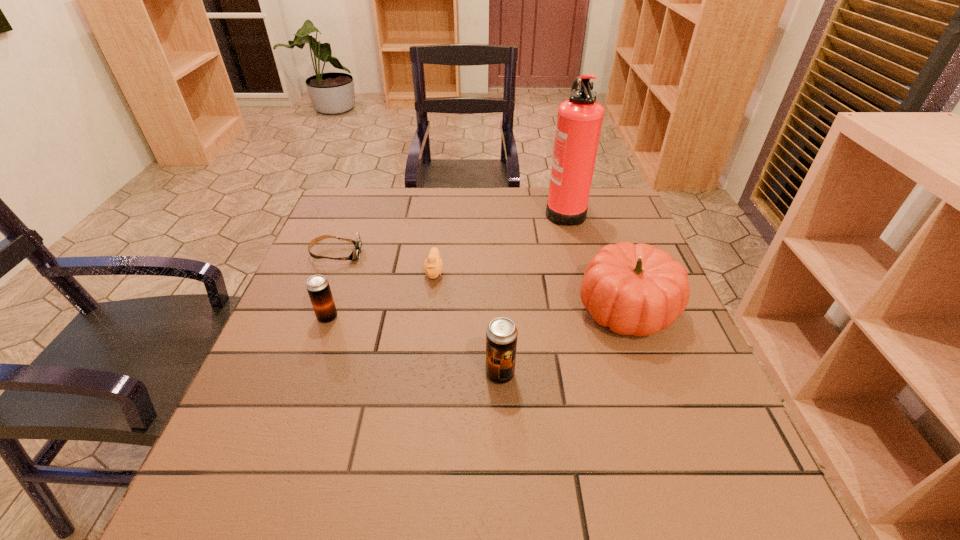
Observe the arrangement of all beer cans in the image. To keep them evenly spaced, where would you place another beer can on the right? Please locate a free space. Please provide its 2D coordinates. Your answer should be formatted as a tuple, i.e. [(x, y)], where the tuple contains the x and y coordinates of a point satisfying the conditions above.

[(726, 449)]